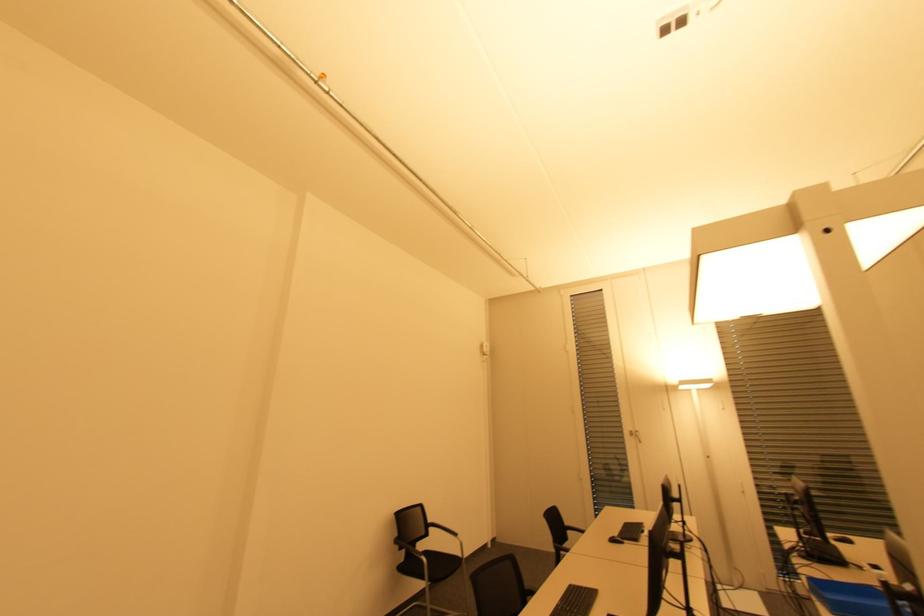
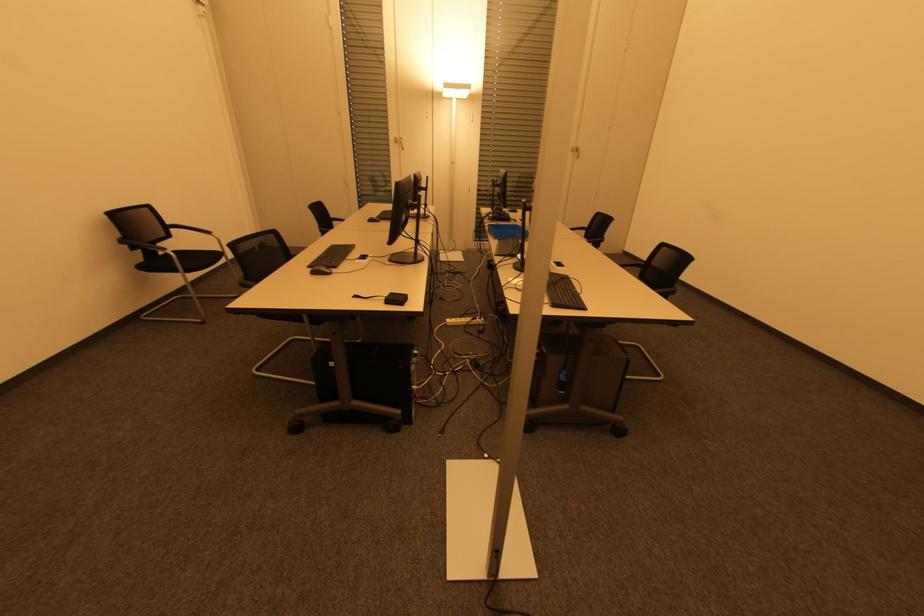
The first image is from the beginning of the video and the second image is from the end. How did the camera likely rotate when shooting the video?

The camera rotated toward right-down.